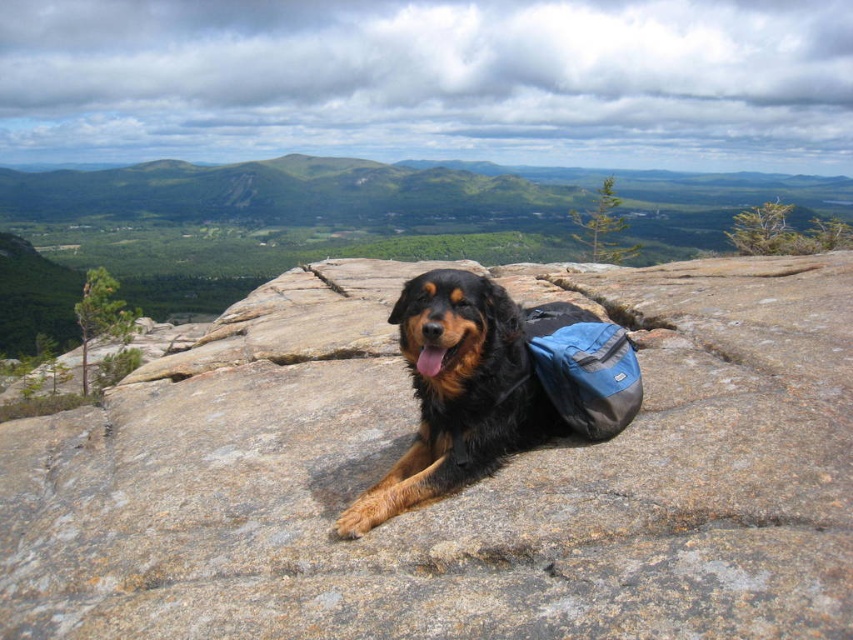
You are a hiker who wants to place a small flag on the highest point between the brown rough rock at center and the shiny brown fur at center. Which object should you choose?

The brown rough rock at center is much taller than the shiny brown fur at center, so you should place the flag on the brown rough rock at center.

The dog is resting on a brown rough rock at center and has shiny brown fur at center. Which object is wider?

The brown rough rock at center is wider than the shiny brown fur at center.

You are a hiker who wants to place a small first aid kit between the brown rough rock at center and the shiny brown fur at center. The first aid kit requires a space of 1.5 meters between them. Can you place it there?

The brown rough rock at center is 1.64 meters away from the shiny brown fur at center. Since the required space is 1.5 meters, the first aid kit can be placed there as the distance is sufficient.